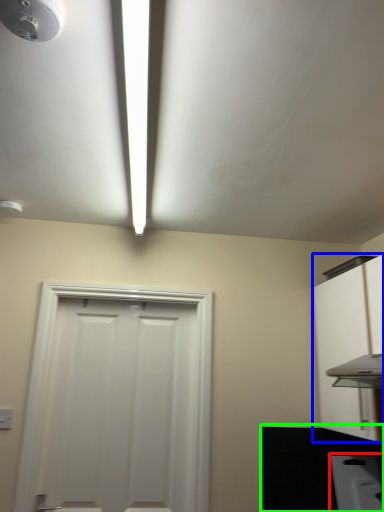
Question: Which object is positioned farthest from appliance (highlighted by a red box)? Select from cabinetry (highlighted by a blue box) and counter top (highlighted by a green box).

Choices:
 (A) cabinetry
 (B) counter top

Answer: (A)